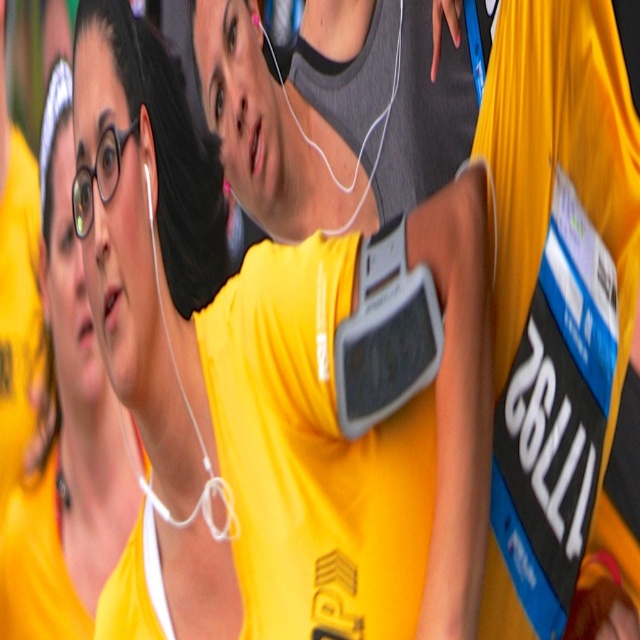
Can you confirm if matte yellow shirt at center is positioned below matte yellow shirt at left?

Yes, matte yellow shirt at center is below matte yellow shirt at left.

Can you confirm if matte yellow shirt at center is thinner than matte yellow shirt at left?

In fact, matte yellow shirt at center might be wider than matte yellow shirt at left.

Image resolution: width=640 pixels, height=640 pixels. In order to click on matte yellow shirt at center in this screenshot , I will do `click(269, 378)`.

The height and width of the screenshot is (640, 640). I want to click on matte yellow shirt at center, so click(x=269, y=378).